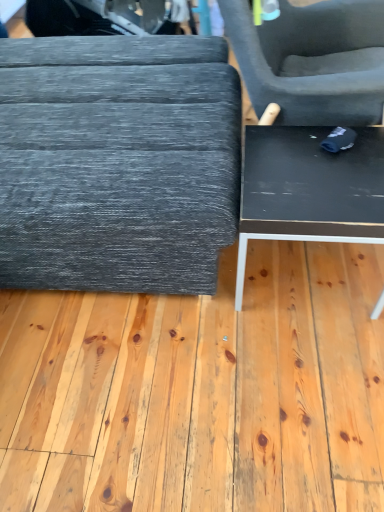
Question: Does matte gray ottoman at left, the 1th table viewed from the left, have a smaller size compared to black matte plywood at center?

Choices:
 (A) yes
 (B) no

Answer: (B)

Question: Is matte gray ottoman at left, the 1th table viewed from the left, thinner than black matte plywood at center?

Choices:
 (A) yes
 (B) no

Answer: (A)

Question: Can you confirm if matte gray ottoman at left, the 1th table viewed from the left, is shorter than black matte plywood at center?

Choices:
 (A) yes
 (B) no

Answer: (B)

Question: Is the depth of matte gray ottoman at left, the 1th table viewed from the left, greater than that of black matte plywood at center?

Choices:
 (A) no
 (B) yes

Answer: (A)

Question: Considering the relative sizes of matte gray ottoman at left, acting as the 2th table starting from the right, and black matte plywood at center in the image provided, is matte gray ottoman at left, acting as the 2th table starting from the right, wider than black matte plywood at center?

Choices:
 (A) no
 (B) yes

Answer: (A)

Question: Is matte gray ottoman at left, acting as the 2th table starting from the right, to the right of black matte plywood at center from the viewer's perspective?

Choices:
 (A) no
 (B) yes

Answer: (A)

Question: Is matte gray ottoman at left, acting as the 2th table starting from the right, at the left side of black glossy table at lower right, the 2th table positioned from the left?

Choices:
 (A) yes
 (B) no

Answer: (A)

Question: Considering the relative sizes of matte gray ottoman at left, the 1th table viewed from the left, and black glossy table at lower right, the 2th table positioned from the left, in the image provided, is matte gray ottoman at left, the 1th table viewed from the left, thinner than black glossy table at lower right, the 2th table positioned from the left,?

Choices:
 (A) no
 (B) yes

Answer: (A)

Question: Considering the relative sizes of matte gray ottoman at left, the 1th table viewed from the left, and black glossy table at lower right, the 2th table positioned from the left, in the image provided, is matte gray ottoman at left, the 1th table viewed from the left, taller than black glossy table at lower right, the 2th table positioned from the left,?

Choices:
 (A) yes
 (B) no

Answer: (A)

Question: From a real-world perspective, is matte gray ottoman at left, the 1th table viewed from the left, over black glossy table at lower right, arranged as the first table when viewed from the right?

Choices:
 (A) yes
 (B) no

Answer: (A)

Question: Can you confirm if matte gray ottoman at left, acting as the 2th table starting from the right, is positioned to the right of black glossy table at lower right, the 2th table positioned from the left?

Choices:
 (A) yes
 (B) no

Answer: (B)

Question: Is matte gray ottoman at left, the 1th table viewed from the left, positioned before black glossy table at lower right, arranged as the first table when viewed from the right?

Choices:
 (A) no
 (B) yes

Answer: (B)

Question: Would you say black glossy table at lower right, arranged as the first table when viewed from the right, is part of black matte plywood at center's contents?

Choices:
 (A) no
 (B) yes

Answer: (A)